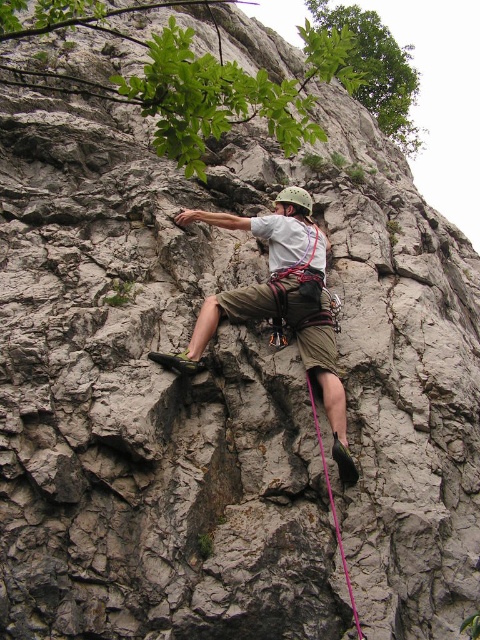
Question: Is matte khaki shorts at center above pink nylon rope at lower center?

Choices:
 (A) yes
 (B) no

Answer: (A)

Question: Can you confirm if matte khaki shorts at center is smaller than pink nylon rope at lower center?

Choices:
 (A) no
 (B) yes

Answer: (A)

Question: Observing the image, what is the correct spatial positioning of matte khaki shorts at center in reference to pink nylon rope at lower center?

Choices:
 (A) above
 (B) below

Answer: (A)

Question: Which of the following is the closest to the observer?

Choices:
 (A) (355, 609)
 (B) (269, 244)

Answer: (A)